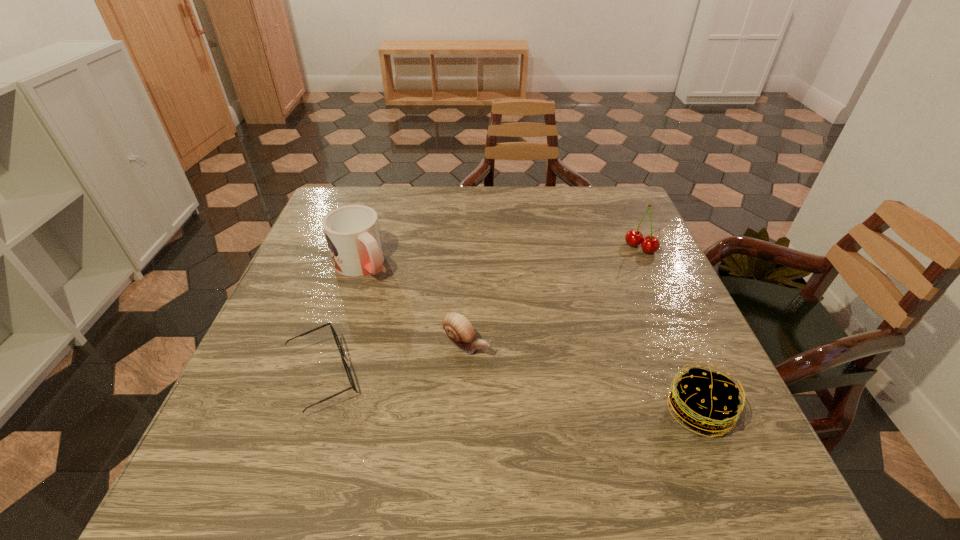
Where is `free spot on the desktop that is between the shortest object and the patty and is positioned on the side of the mug with the handle`? This screenshot has height=540, width=960. free spot on the desktop that is between the shortest object and the patty and is positioned on the side of the mug with the handle is located at coordinates (482, 390).

Where is `vacant spot on the desktop that is between the spectacles and the patty and is positioned with the stems of the cherry pointing upwards`? The image size is (960, 540). vacant spot on the desktop that is between the spectacles and the patty and is positioned with the stems of the cherry pointing upwards is located at coordinates (503, 393).

Find the location of `free space on the desktop that is between the spectacles and the patty and is positioned on the front-facing side of the second shortest object`. free space on the desktop that is between the spectacles and the patty and is positioned on the front-facing side of the second shortest object is located at coordinates (553, 397).